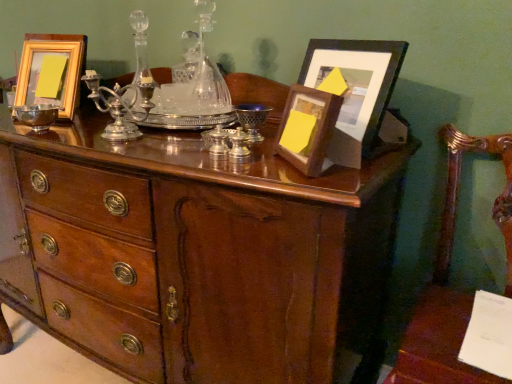
Locate an element on the screen. Image resolution: width=512 pixels, height=384 pixels. vacant area that lies between shiny silver candle holder at center, which is counted as the 1th candle holder, starting from the right, and wooden picture frame at upper right, which is the second picture frame from left to right is located at coordinates (267, 164).